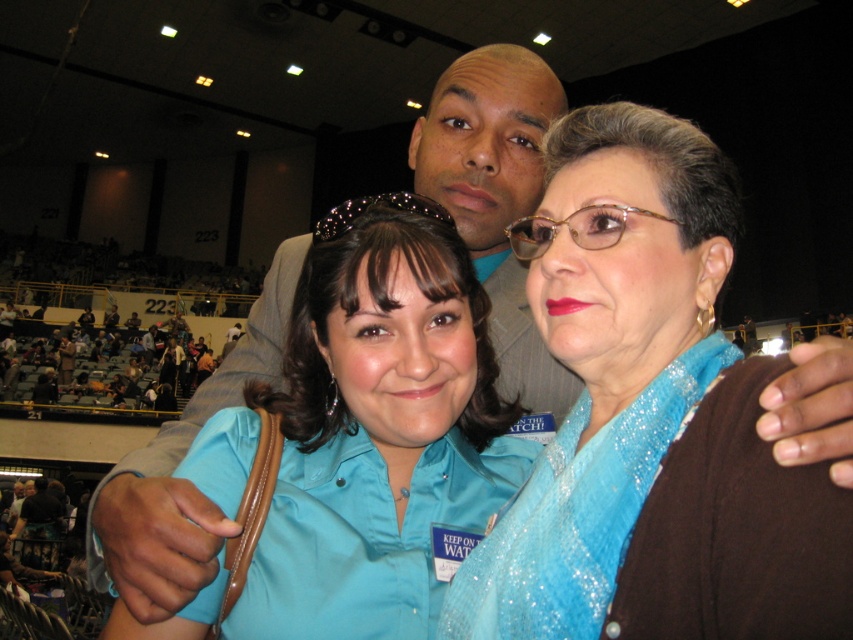
Who is lower down, sparkly blue scarf at center or matte blue shirt at center?

matte blue shirt at center is below.

Does sparkly blue scarf at center appear on the left side of matte blue shirt at center?

Incorrect, sparkly blue scarf at center is not on the left side of matte blue shirt at center.

Find the location of a particular element. Image resolution: width=853 pixels, height=640 pixels. sparkly blue scarf at center is located at coordinates (650, 419).